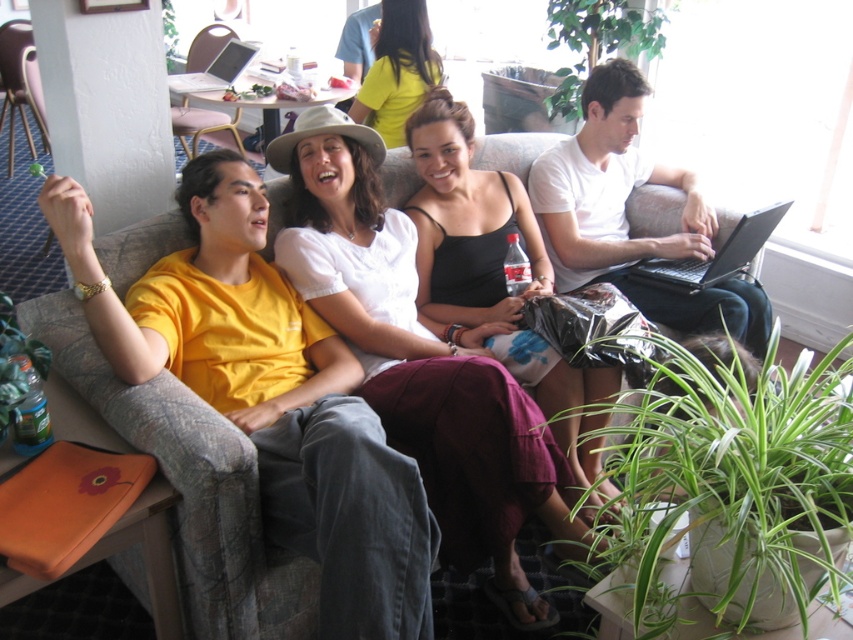
You are a photographer trying to capture a candid shot of the matte yellow shirt at center without including the silver metallic laptop at upper left in the frame. Based on their positions, is this possible?

The matte yellow shirt at center is in front of the silver metallic laptop at upper left, so it is possible to capture the matte yellow shirt at center without including the silver metallic laptop at upper left in the frame by positioning the camera to focus on the foreground subject.